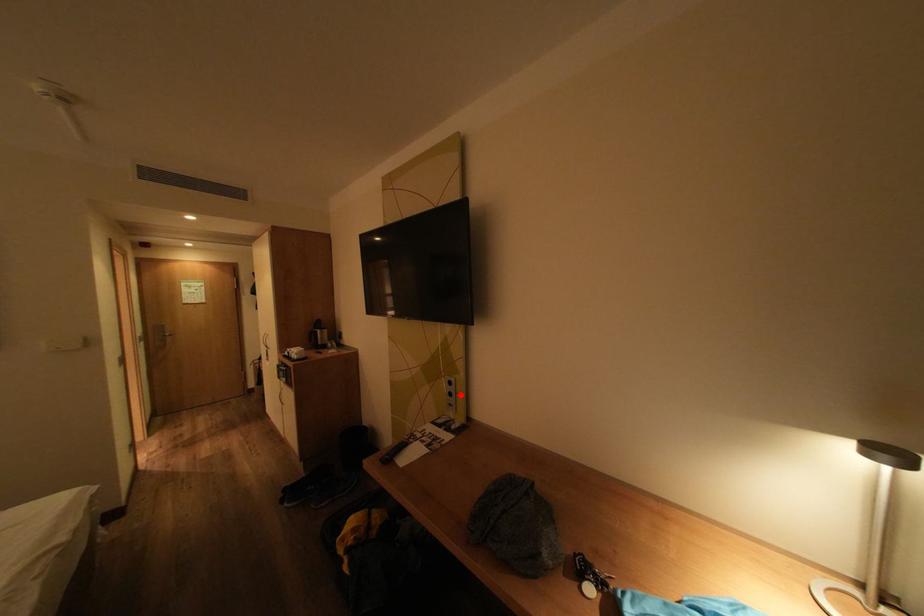
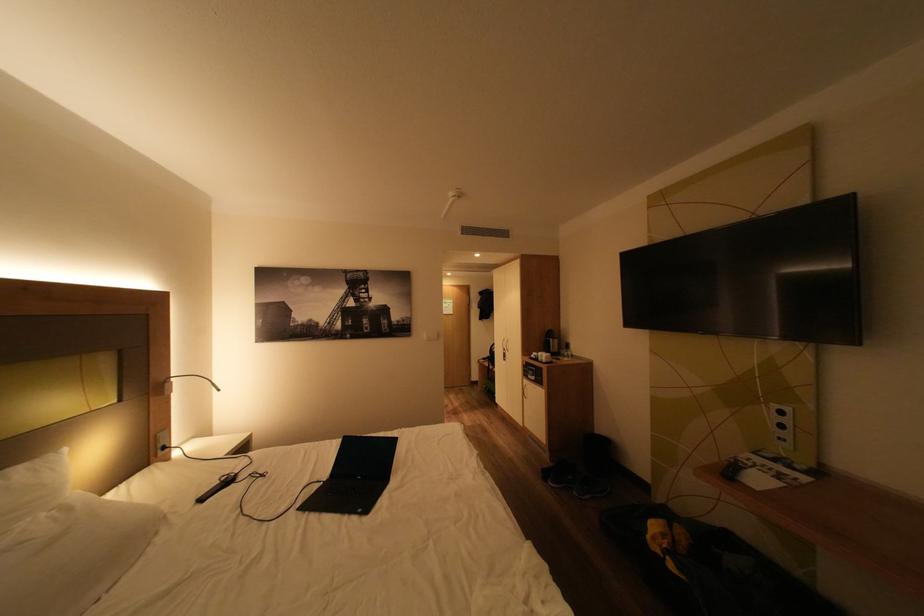
Locate, in the second image, the point that corresponds to the highlighted location in the first image.

(793, 427)